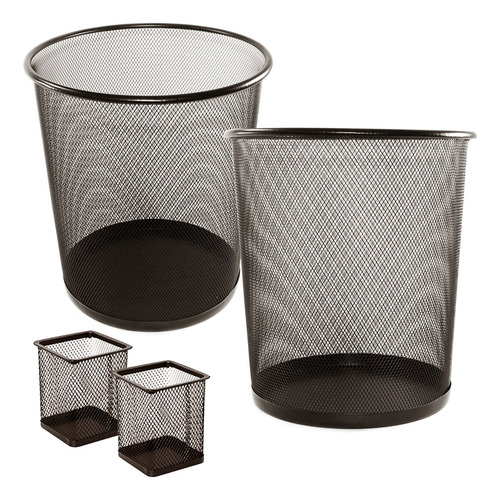
Identify the location of wire container. The image size is (500, 500). (158, 198), (318, 235), (71, 388), (156, 418).